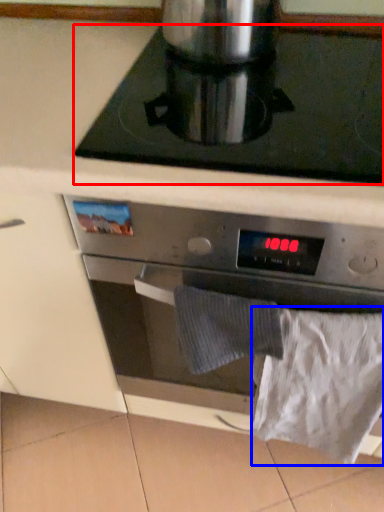
Question: Which point is further to the camera, gas stove (highlighted by a red box) or sheet (highlighted by a blue box)?

Choices:
 (A) gas stove
 (B) sheet

Answer: (B)